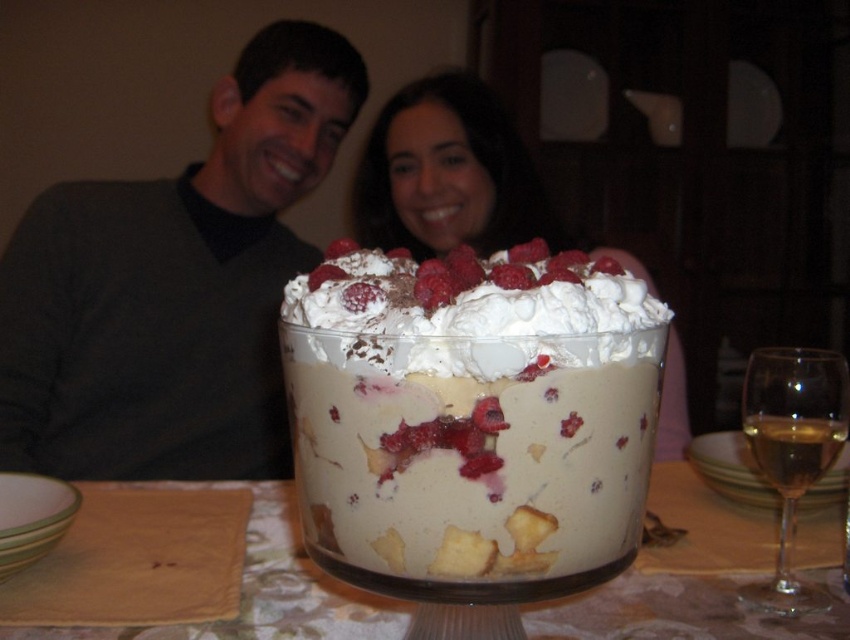
Is smooth skin face at center thinner than translucent glass wine at right?

In fact, smooth skin face at center might be wider than translucent glass wine at right.

Which is more to the right, smooth skin face at center or translucent glass wine at right?

Positioned to the right is translucent glass wine at right.

The image size is (850, 640). In order to click on smooth skin face at center in this screenshot , I will do `click(448, 173)`.

This screenshot has height=640, width=850. Find the location of `translucent glass trifle at center`. translucent glass trifle at center is located at coordinates (687, 595).

Which of these two, translucent glass trifle at center or translucent glass wine at right, stands shorter?

Standing shorter between the two is translucent glass trifle at center.

The height and width of the screenshot is (640, 850). In order to click on translucent glass trifle at center in this screenshot , I will do `click(687, 595)`.

You are a GUI agent. You are given a task and a screenshot of the screen. Output one action in this format:
    pyautogui.click(x=<x>, y=<y>)
    Task: Click on the dark gray sweater at center
    
    Given the screenshot: What is the action you would take?
    pyautogui.click(x=174, y=285)

This screenshot has height=640, width=850. I want to click on dark gray sweater at center, so click(174, 285).

Find the location of a particular element. This screenshot has height=640, width=850. dark gray sweater at center is located at coordinates (174, 285).